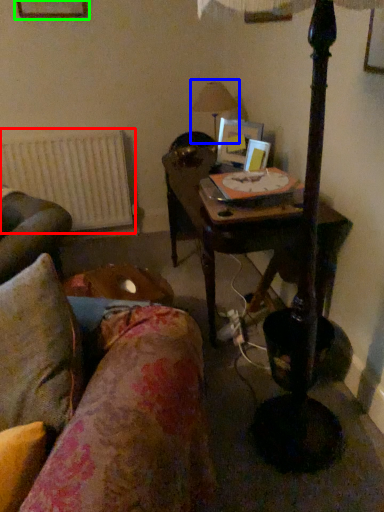
Question: Considering the real-world distances, which object is farthest from radiator (highlighted by a red box)? table lamp (highlighted by a blue box) or picture frame (highlighted by a green box)?

Choices:
 (A) table lamp
 (B) picture frame

Answer: (B)